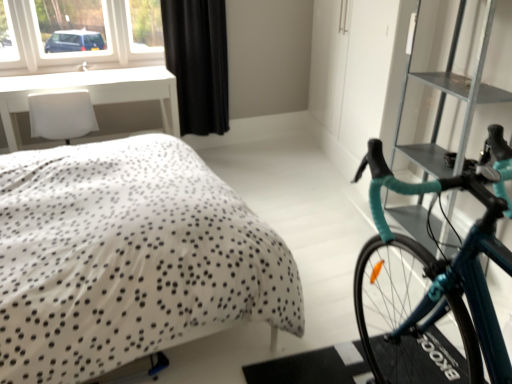
Question: From a real-world perspective, is white glossy table at upper left positioned over white dotted fabric bed at center based on gravity?

Choices:
 (A) yes
 (B) no

Answer: (A)

Question: Is white glossy table at upper left wider than white dotted fabric bed at center?

Choices:
 (A) no
 (B) yes

Answer: (A)

Question: Can you confirm if white glossy table at upper left is bigger than white dotted fabric bed at center?

Choices:
 (A) no
 (B) yes

Answer: (A)

Question: Can you confirm if white glossy table at upper left is thinner than white dotted fabric bed at center?

Choices:
 (A) yes
 (B) no

Answer: (A)

Question: Does white glossy table at upper left appear on the right side of white dotted fabric bed at center?

Choices:
 (A) yes
 (B) no

Answer: (B)

Question: Is point (120, 89) positioned closer to the camera than point (186, 198)?

Choices:
 (A) closer
 (B) farther

Answer: (B)

Question: From the image's perspective, is white glossy table at upper left above or below white dotted fabric bed at center?

Choices:
 (A) above
 (B) below

Answer: (A)

Question: Is white glossy table at upper left to the left or to the right of white dotted fabric bed at center in the image?

Choices:
 (A) right
 (B) left

Answer: (B)

Question: Is white glossy table at upper left situated inside white dotted fabric bed at center or outside?

Choices:
 (A) inside
 (B) outside

Answer: (B)

Question: Looking at the image, does teal glossy bicycle at right seem bigger or smaller compared to white plastic window at upper left?

Choices:
 (A) big
 (B) small

Answer: (A)

Question: From the image's perspective, is teal glossy bicycle at right located above or below white plastic window at upper left?

Choices:
 (A) above
 (B) below

Answer: (B)

Question: Is teal glossy bicycle at right taller or shorter than white plastic window at upper left?

Choices:
 (A) short
 (B) tall

Answer: (B)

Question: From a real-world perspective, is teal glossy bicycle at right physically located above or below white plastic window at upper left?

Choices:
 (A) below
 (B) above

Answer: (A)

Question: From the image's perspective, is white plastic window at upper left above or below teal glossy bicycle at right?

Choices:
 (A) above
 (B) below

Answer: (A)

Question: Relative to teal glossy bicycle at right, is white plastic window at upper left in front or behind?

Choices:
 (A) behind
 (B) front

Answer: (A)